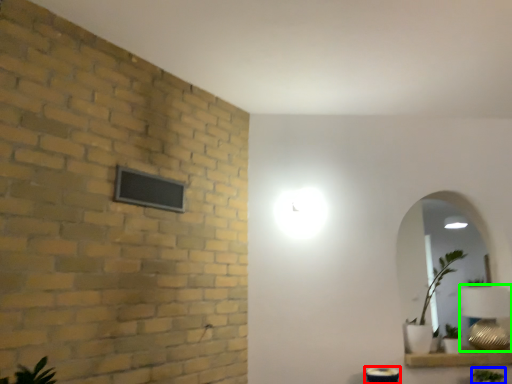
Question: Which is nearer to the table (highlighted by a red box)? plant (highlighted by a blue box) or table lamp (highlighted by a green box).

Choices:
 (A) plant
 (B) table lamp

Answer: (A)